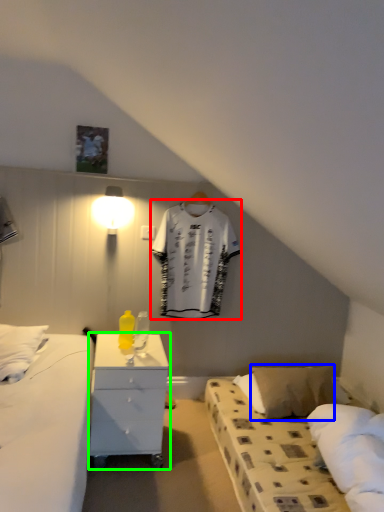
Question: Considering the real-world distances, which object is closest to clothing (highlighted by a red box)? pillow (highlighted by a blue box) or nightstand (highlighted by a green box).

Choices:
 (A) pillow
 (B) nightstand

Answer: (B)